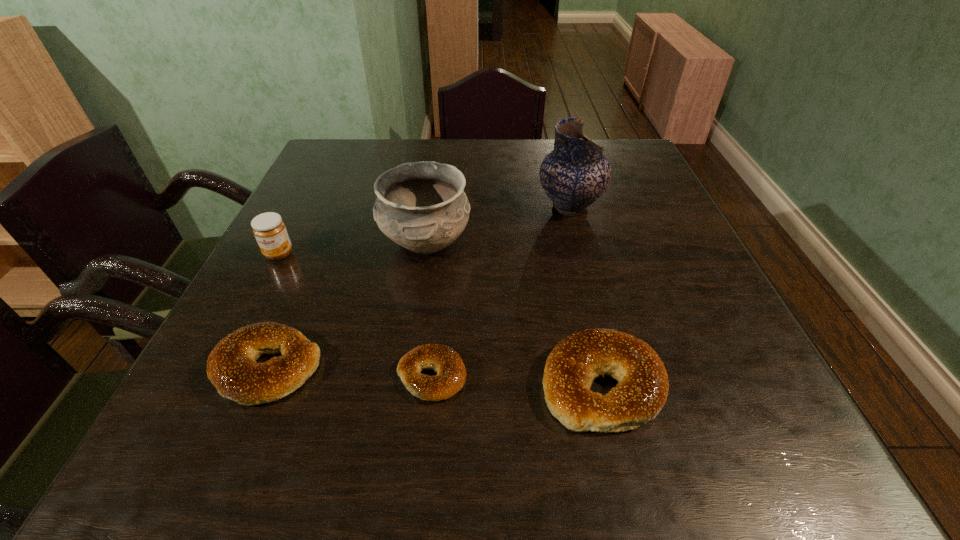
Observe the arrangement of all bagels in the image. To keep them evenly spaced, where would you place another bagel on the right? Please locate a free space. Please provide its 2D coordinates. Your answer should be formatted as a tuple, i.e. [(x, y)], where the tuple contains the x and y coordinates of a point satisfying the conditions above.

[(777, 393)]